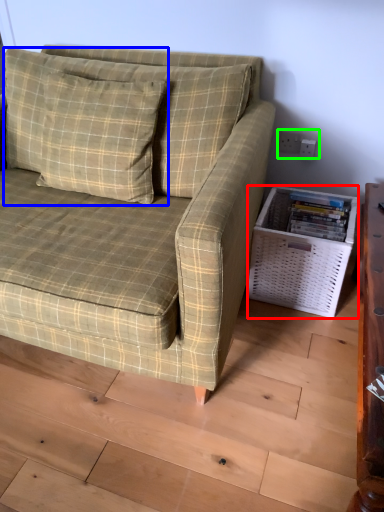
Question: Based on their relative distances, which object is farther from basket (highlighted by a red box)? Choose from pillow (highlighted by a blue box) and electric outlet (highlighted by a green box).

Choices:
 (A) pillow
 (B) electric outlet

Answer: (A)